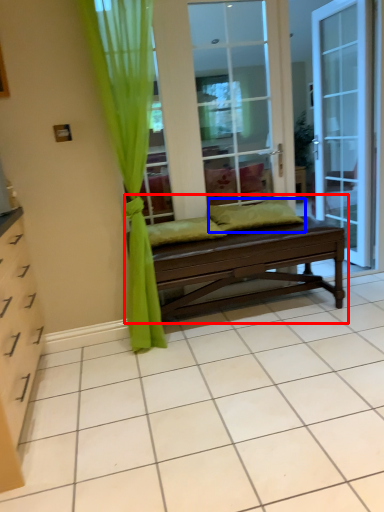
Question: Which of the following is the farthest to the observer, studio couch (highlighted by a red box) or pillow (highlighted by a blue box)?

Choices:
 (A) studio couch
 (B) pillow

Answer: (B)